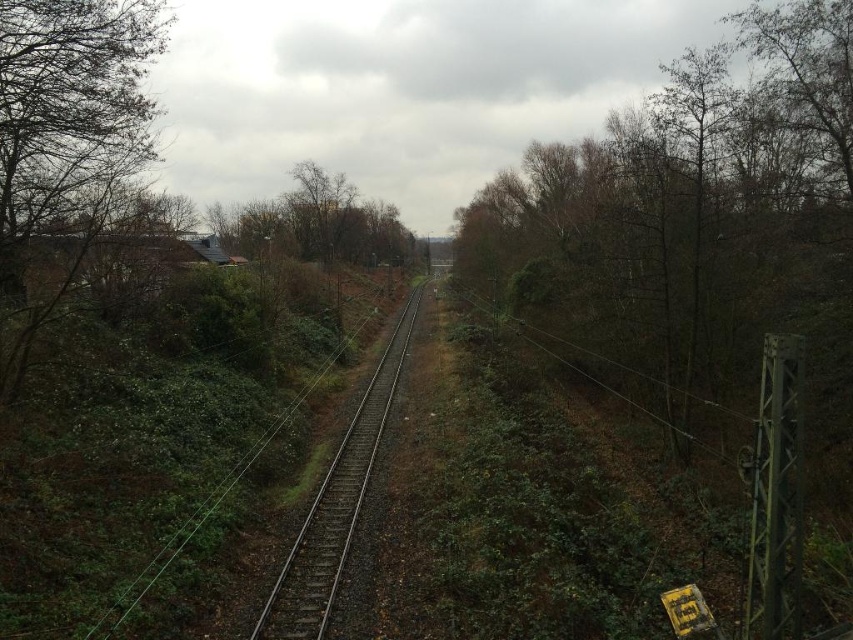
Is point (64, 172) in front of point (338, 497)?

No, it is not.

Is green leafy tree at left positioned behind metal train track at center?

Yes, it is behind metal train track at center.

Is point (85, 163) closer to camera compared to point (346, 500)?

No, it is behind (346, 500).

At what (x,y) coordinates should I click in order to perform the action: click on green leafy tree at left. Please return your answer as a coordinate pair (x, y). The width and height of the screenshot is (853, 640). Looking at the image, I should click on (65, 138).

Looking at this image, between brown leafy tree at right and metal train track at center, which one has less height?

metal train track at center is shorter.

Does brown leafy tree at right appear under metal train track at center?

No.

Find the location of a particular element. This screenshot has height=640, width=853. brown leafy tree at right is located at coordinates (695, 228).

Who is higher up, brown leafy tree at right or green leafy tree at left?

brown leafy tree at right is higher up.

Is brown leafy tree at right in front of green leafy tree at left?

No.

Between point (734, 216) and point (3, 253), which one is positioned behind?

Positioned behind is point (734, 216).

Image resolution: width=853 pixels, height=640 pixels. In order to click on brown leafy tree at right in this screenshot , I will do `click(695, 228)`.